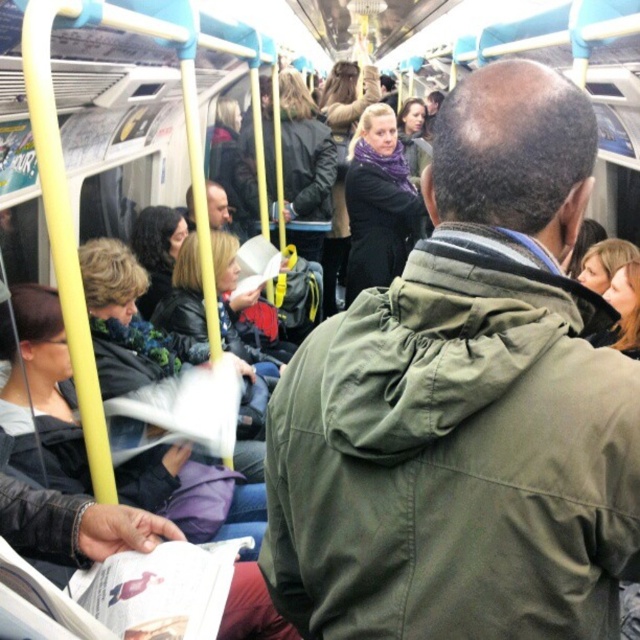
You are a passenger on a crowded train and you see the green matte jacket at center and the matte black jacket at center. Which one is located to the right of the other?

The green matte jacket at center is positioned on the right side of matte black jacket at center.

You are a passenger on a crowded train and need to reach the exit door located at the front of the car. There is a green matte jacket at center blocking your path. Can you estimate how far you need to move to the left or right to go around the jacket?

The green matte jacket at center is located at coordinates point [465,406]. To navigate around it, you would need to move either to the left or right depending on the available space in the train car.

You are a passenger on the train and want to reach the matte black jacket at center to retrieve your dropped item. Is the green matte jacket at center blocking your path? Explain why.

Yes, the green matte jacket at center is blocking your path to the matte black jacket at center because the green matte jacket at center is closer to the viewer than the matte black jacket at center.